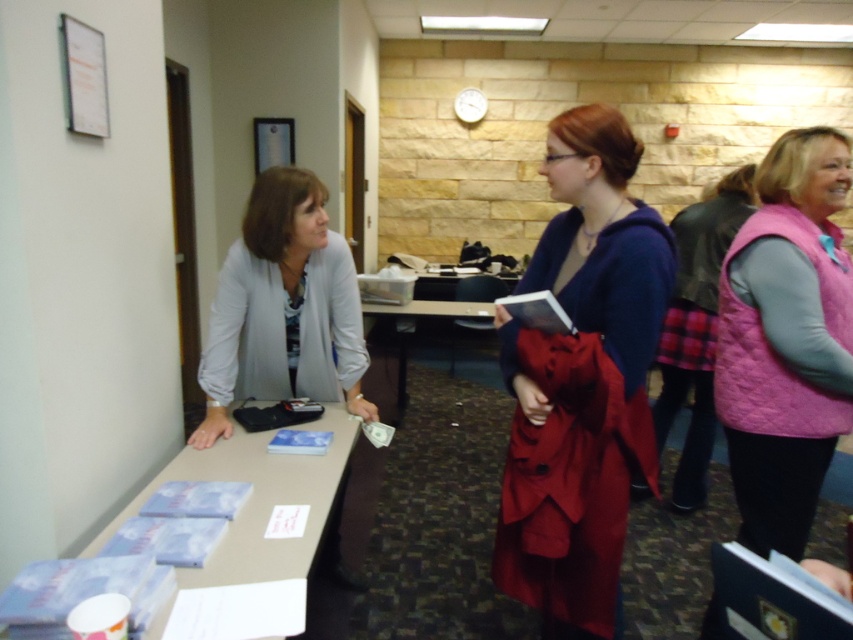
Does velvet purple coat at center have a lesser width compared to light brown laminate table at lower left?

Yes.

Which is above, velvet purple coat at center or light brown laminate table at lower left?

velvet purple coat at center

Find the location of a particular element. This screenshot has width=853, height=640. velvet purple coat at center is located at coordinates (582, 381).

You are a GUI agent. You are given a task and a screenshot of the screen. Output one action in this format:
    pyautogui.click(x=<x>, y=<y>)
    Task: Click on the velvet purple coat at center
    The image size is (853, 640).
    Given the screenshot: What is the action you would take?
    pyautogui.click(x=582, y=381)

What do you see at coordinates (426, 330) in the screenshot? I see `wooden table at center` at bounding box center [426, 330].

Who is more forward, (485, 323) or (363, 509)?

Point (363, 509) is more forward.

Who is more forward, (364, 323) or (242, 435)?

Point (242, 435) is in front.

Where is `wooden table at center`? wooden table at center is located at coordinates (426, 330).

Does velvet purple coat at center have a lesser width compared to wooden table at center?

Yes, velvet purple coat at center is thinner than wooden table at center.

Between point (508, 488) and point (405, 401), which one is positioned in front?

Point (508, 488)

The image size is (853, 640). I want to click on velvet purple coat at center, so click(582, 381).